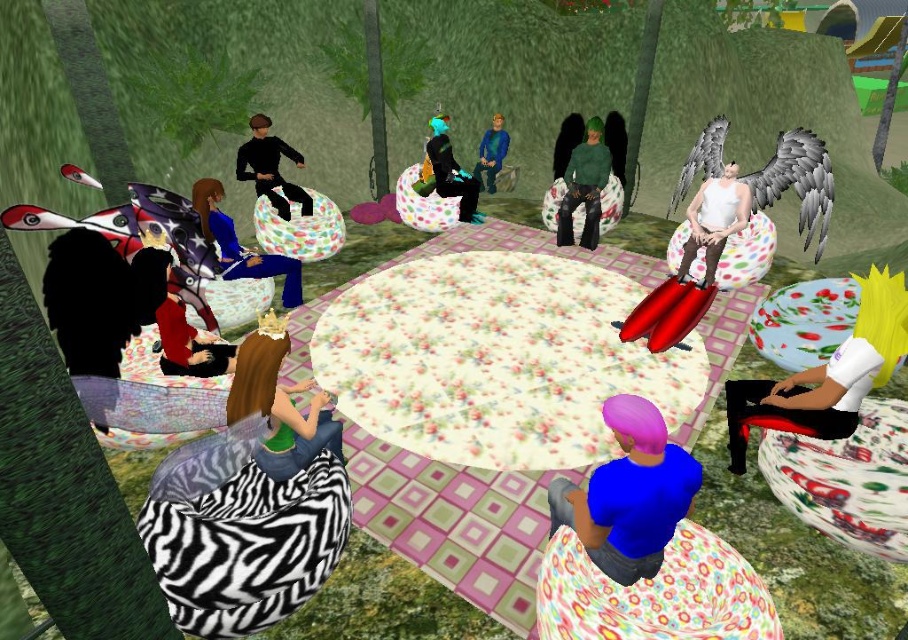
You are organizing a photoshoot and need to ensure that the white matte tank top at center and the black matte clothing at center are visible in the frame. Given their sizes, which one might you need to position closer to the camera to ensure it doesn

The white matte tank top at center has a lesser width compared to the black matte clothing at center. To ensure visibility, position the white matte tank top at center closer to the camera since it is smaller in width and might be less noticeable from a distance.

You are standing in the tropical outdoor setting and want to place a small decorative item between the two points marked as point [714,237] and point [287,218]. Based on their positions, which point is closer to you, making it the better spot for placement?

Point [714,237] is closer to the camera than point [287,218], so placing the item near point [714,237] would be closer to you.